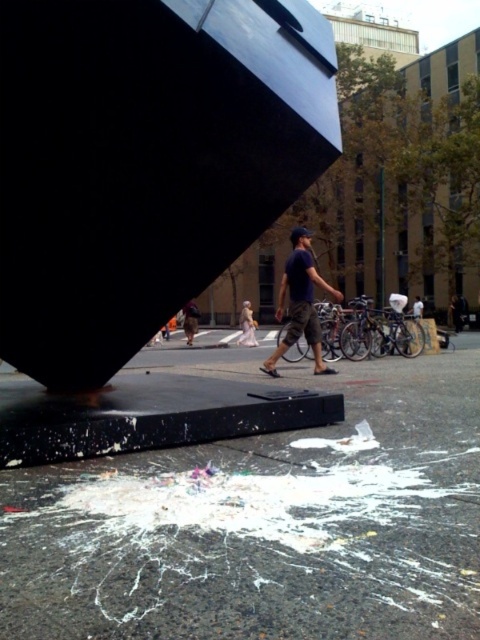
Question: Can you confirm if dark blue t-shirt at center is thinner than denim jacket at center?

Choices:
 (A) yes
 (B) no

Answer: (A)

Question: Which of the following is the closest to the observer?

Choices:
 (A) light brown fabric dress at center
 (B) dark blue t-shirt at center

Answer: (B)

Question: Which point is closer to the camera taking this photo?

Choices:
 (A) tap(240, 316)
 (B) tap(304, 547)
 (C) tap(190, 332)

Answer: (B)

Question: Can you confirm if granite at lower center is positioned to the left of denim jacket at center?

Choices:
 (A) yes
 (B) no

Answer: (B)

Question: Which point is closer to the camera?

Choices:
 (A) 186,314
 (B) 272,365

Answer: (B)

Question: Does dark blue t-shirt at center lie behind denim jacket at center?

Choices:
 (A) no
 (B) yes

Answer: (B)